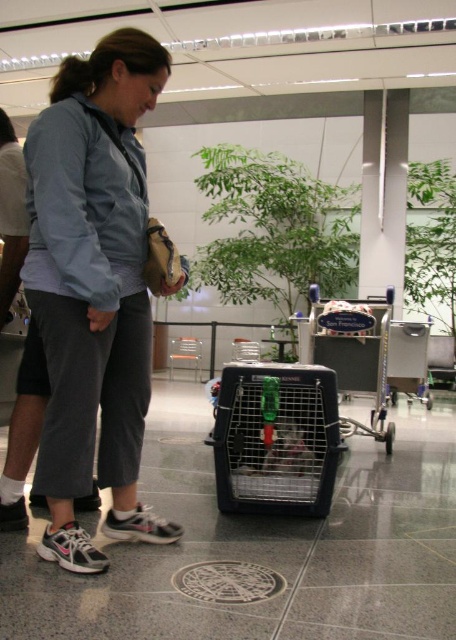
Can you confirm if gray fabric pants at lower center is positioned below black plastic pet carrier at center?

Incorrect, gray fabric pants at lower center is not positioned below black plastic pet carrier at center.

Can you confirm if gray fabric pants at lower center is wider than black plastic pet carrier at center?

No, gray fabric pants at lower center is not wider than black plastic pet carrier at center.

Describe the element at coordinates (93, 289) in the screenshot. I see `gray fabric pants at lower center` at that location.

Where is `gray fabric pants at lower center`? gray fabric pants at lower center is located at coordinates (93, 289).

Is point (243, 480) closer to camera compared to point (310, 316)?

Yes, it is.

Who is more forward, (278, 380) or (346, 435)?

Point (278, 380) is more forward.

Is point (298, 465) positioned behind point (373, 413)?

No, (298, 465) is in front of (373, 413).

The image size is (456, 640). I want to click on black plastic pet carrier at center, so click(275, 440).

Is gray fabric pants at lower center thinner than metallic silver shopping cart at center?

Correct, gray fabric pants at lower center's width is less than metallic silver shopping cart at center's.

Can you confirm if gray fabric pants at lower center is positioned to the right of metallic silver shopping cart at center?

No, gray fabric pants at lower center is not to the right of metallic silver shopping cart at center.

Between point (141, 224) and point (372, 364), which one is positioned behind?

The point (372, 364) is more distant.

Locate an element on the screen. The width and height of the screenshot is (456, 640). gray fabric pants at lower center is located at coordinates (93, 289).